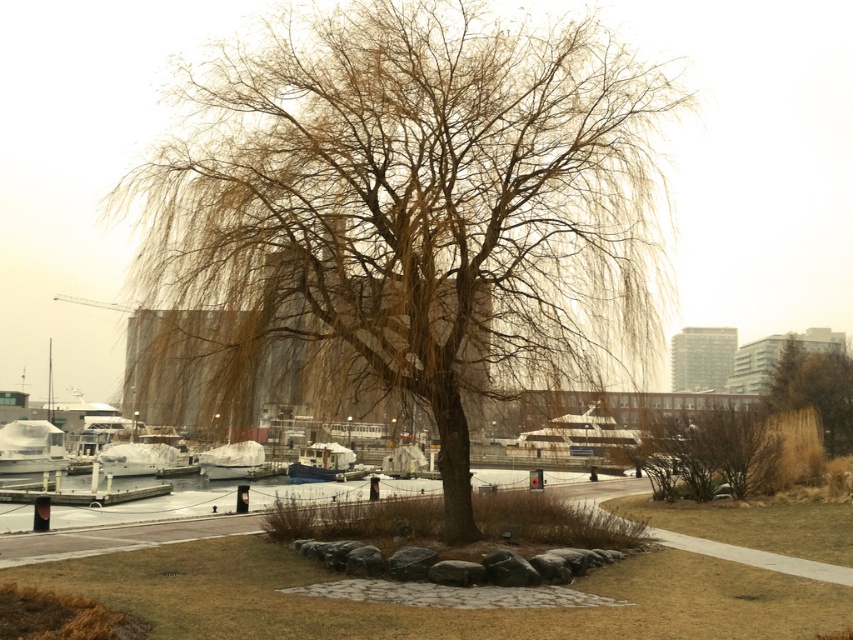
Does brown/dry bush at lower right have a lesser height compared to white matte boat at lower left?

No, brown/dry bush at lower right is not shorter than white matte boat at lower left.

Is point (778, 436) behind point (12, 458)?

No, it is not.

Does point (757, 476) lie behind point (38, 445)?

That is False.

The image size is (853, 640). I want to click on brown/dry bush at lower right, so click(x=709, y=452).

Does white matte boat at lower left appear on the right side of white matte boat at lower center?

In fact, white matte boat at lower left is to the left of white matte boat at lower center.

Is white matte boat at lower left taller than white matte boat at lower center?

Yes.

Where is `white matte boat at lower left`? white matte boat at lower left is located at coordinates (32, 445).

Does brown textured tree at right appear over white matte boat at lower left?

Yes.

At what (x,y) coordinates should I click in order to perform the action: click on brown textured tree at right. Please return your answer as a coordinate pair (x, y). Looking at the image, I should click on (815, 390).